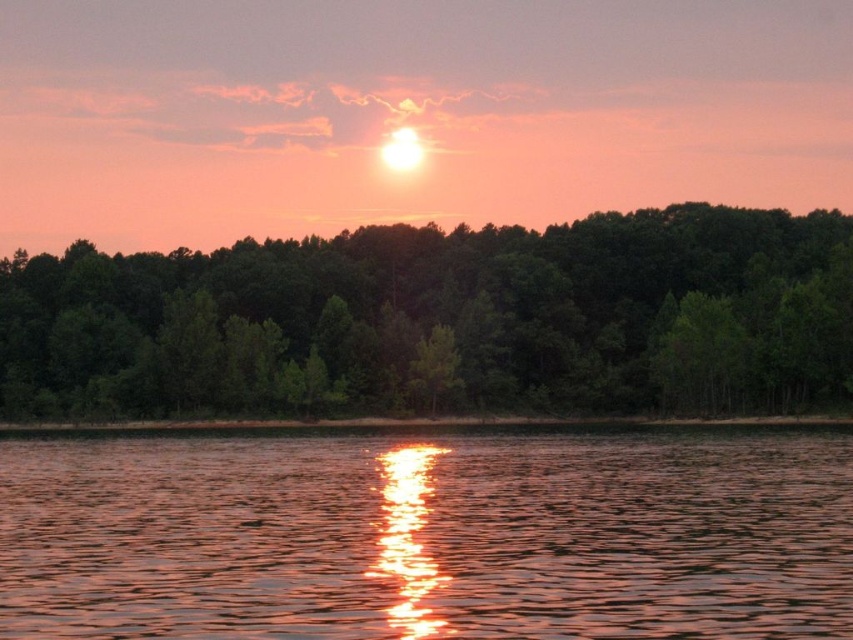
Based on the photo, which is more to the left, glistening water at center or green matte trees at center?

green matte trees at center is more to the left.

Is glistening water at center taller than green matte trees at center?

No, glistening water at center is not taller than green matte trees at center.

Who is more forward, (831, 516) or (218, 372)?

Point (831, 516)

Find the location of a particular element. glistening water at center is located at coordinates (427, 536).